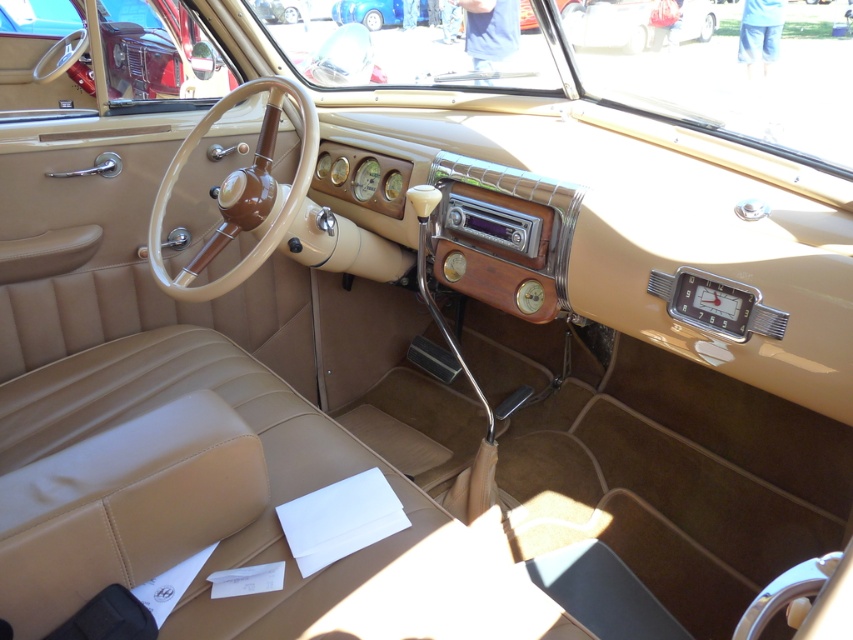
You are sitting in the driver seat of the vintage car and looking at the dashboard. You need to locate the matte wood steering wheel at upper left and the blue metallic car at upper center. Which object is positioned to the left of the other?

The matte wood steering wheel at upper left is positioned to the left of the blue metallic car at upper center.

You are a driver sitting in the vintage car. You notice the matte wood steering wheel at upper left and the blue metallic car at upper center in your view. Which object appears taller in your field of view?

The matte wood steering wheel at upper left appears taller than the blue metallic car at upper center because it has a greater height compared to it.

You are sitting in the driver seat of the vintage car. You need to adjust the radio located on the dashboard. Which object, the matte wood steering wheel at upper left or the blue metallic car at upper center, is closer to you when you reach forward to adjust the radio?

The matte wood steering wheel at upper left is closer to the viewer than the blue metallic car at upper center, so you would first encounter the matte wood steering wheel at upper left when reaching forward.